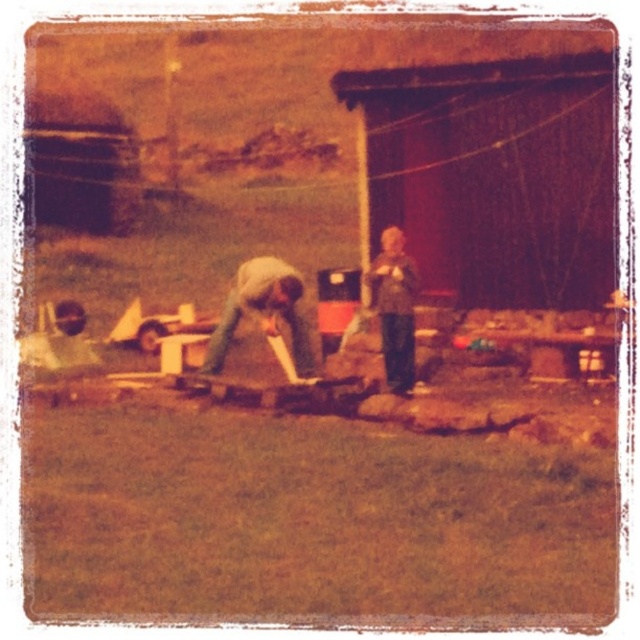
Identify the location of denim jacket at center. The image size is (640, 640). (262, 312).

From the picture: Which is more to the left, denim jacket at center or textured gray sweater at center?

Positioned to the left is denim jacket at center.

The image size is (640, 640). In order to click on denim jacket at center in this screenshot , I will do `click(262, 312)`.

You are a GUI agent. You are given a task and a screenshot of the screen. Output one action in this format:
    pyautogui.click(x=<x>, y=<y>)
    Task: Click on the denim jacket at center
    
    Given the screenshot: What is the action you would take?
    pyautogui.click(x=262, y=312)